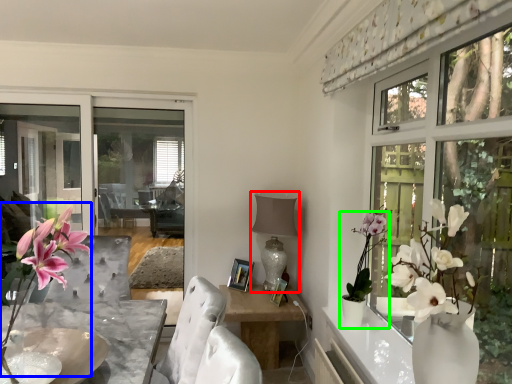
Question: Estimate the real-world distances between objects in this image. Which object is farther from lamp (highlighted by a red box), floral arrangement (highlighted by a blue box) or houseplant (highlighted by a green box)?

Choices:
 (A) floral arrangement
 (B) houseplant

Answer: (A)